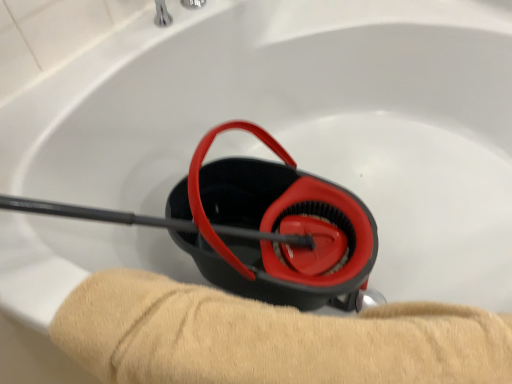
Locate an element on the screen. Image resolution: width=512 pixels, height=384 pixels. vacant point above soft beige towel at lower center (from a real-world perspective) is located at coordinates (245, 341).